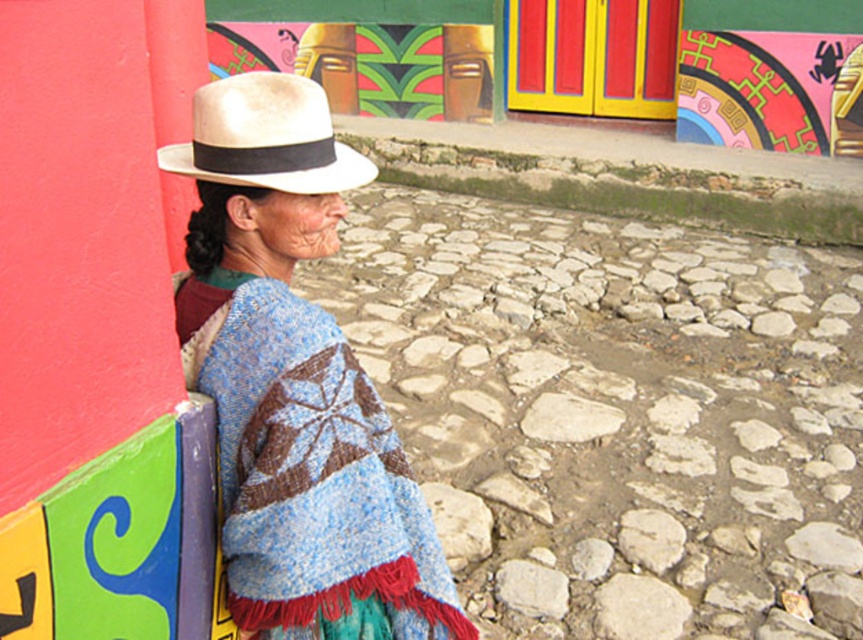
Between point (295, 365) and point (211, 90), which one is positioned in front?

Positioned in front is point (295, 365).

The height and width of the screenshot is (640, 863). What do you see at coordinates (295, 381) in the screenshot?
I see `knitted wool shawl at left` at bounding box center [295, 381].

What are the coordinates of `knitted wool shawl at left` in the screenshot? It's located at (295, 381).